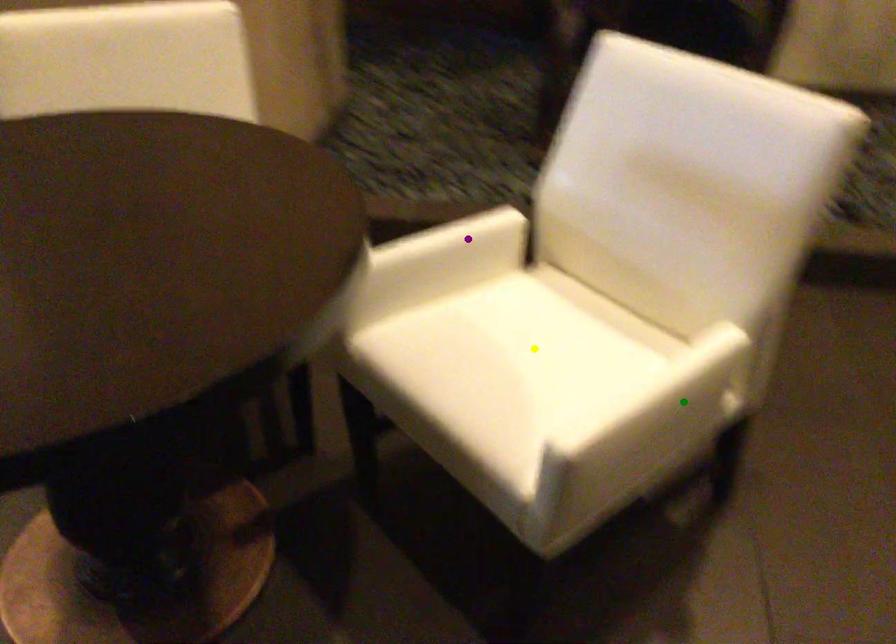
Order these from nearest to farthest:
A) green point
B) yellow point
C) purple point

green point, yellow point, purple point